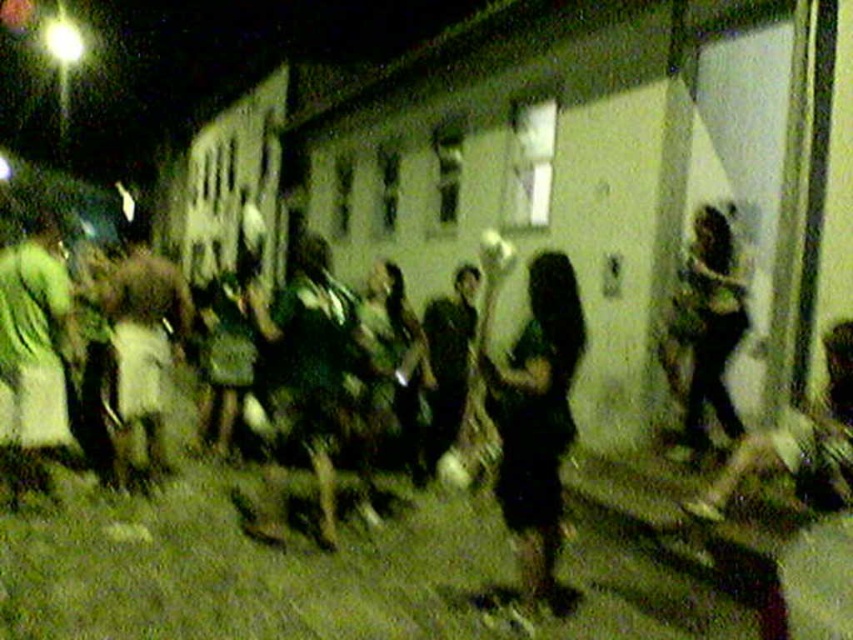
Describe the element at coordinates (33, 352) in the screenshot. I see `green fabric dress at left` at that location.

I want to click on green fabric dress at left, so pyautogui.click(x=33, y=352).

What do you see at coordinates (302, 380) in the screenshot? This screenshot has height=640, width=853. I see `green fabric shirt at center` at bounding box center [302, 380].

Is green fabric shirt at center to the left of green fabric dress at left from the viewer's perspective?

Incorrect, green fabric shirt at center is not on the left side of green fabric dress at left.

Which is in front, point (314, 314) or point (9, 260)?

Point (314, 314)

The image size is (853, 640). What are the coordinates of `green fabric shirt at center` in the screenshot? It's located at (302, 380).

Can you confirm if green fabric shirt at center is smaller than dark green fabric dress at right?

Actually, green fabric shirt at center might be larger than dark green fabric dress at right.

Can you confirm if green fabric shirt at center is shorter than dark green fabric dress at right?

Yes.

Which is behind, point (254, 296) or point (743, 310)?

The point (254, 296) is more distant.

In order to click on green fabric shirt at center in this screenshot , I will do `click(302, 380)`.